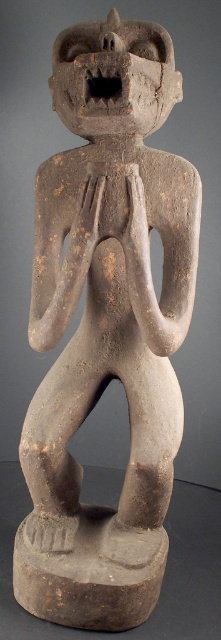
From the picture: Looking at the ancient African sculpture, which object is positioned to the left of the other between the brown clay hand at center and the brown clay hands at center?

The brown clay hand at center is positioned to the left of the brown clay hands at center.

You are an art conservator examining the ancient African sculpture. You notice two points on the sculpture marked at coordinates point (89,209) and point (144,224). Which of these points is nearer to your viewpoint as you face the sculpture?

Point (89,209) is closer to the camera than point (144,224), so the point at (89,209) is nearer to your viewpoint.